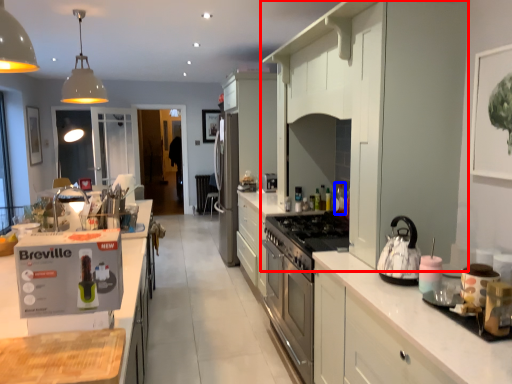
Question: Among these objects, which one is farthest to the camera, cabinetry (highlighted by a red box) or bottle (highlighted by a blue box)?

Choices:
 (A) cabinetry
 (B) bottle

Answer: (B)